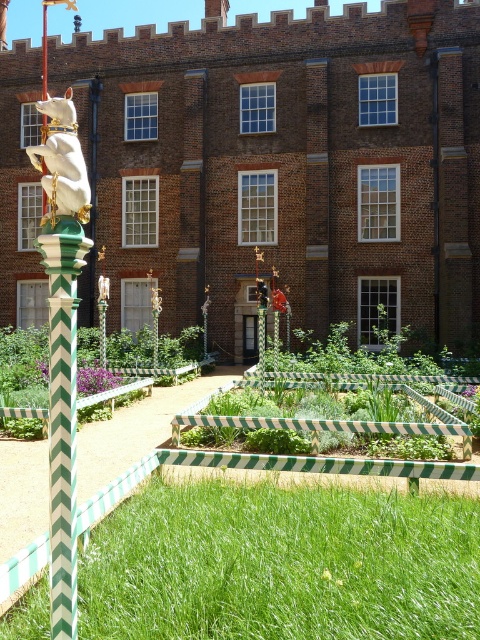
Question: Which object is closer to the camera taking this photo?

Choices:
 (A) white glossy statue at left
 (B) green striped planter at center
 (C) green striped pole at left

Answer: (C)

Question: Which of the following is the farthest from the observer?

Choices:
 (A) green striped planter at center
 (B) green striped pole at left
 (C) white glossy statue at left

Answer: (A)

Question: Is green striped planter at center positioned before green striped pole at left?

Choices:
 (A) yes
 (B) no

Answer: (B)

Question: Can you confirm if green striped planter at center is smaller than green striped pole at left?

Choices:
 (A) yes
 (B) no

Answer: (A)

Question: Estimate the real-world distances between objects in this image. Which object is farther from the white glossy statue at left?

Choices:
 (A) green striped pole at left
 (B) green striped planter at center

Answer: (A)

Question: Does green striped planter at center have a greater width compared to white glossy statue at left?

Choices:
 (A) no
 (B) yes

Answer: (A)